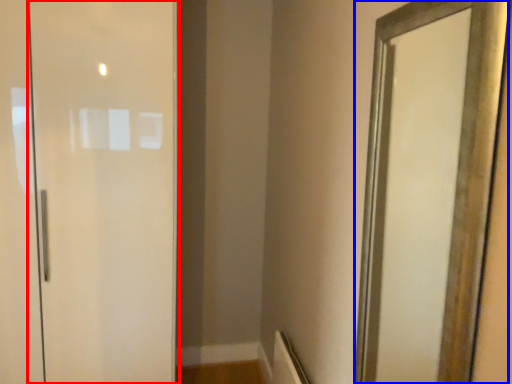
Question: Which object is closer to the camera taking this photo, door (highlighted by a red box) or mirror (highlighted by a blue box)?

Choices:
 (A) door
 (B) mirror

Answer: (B)